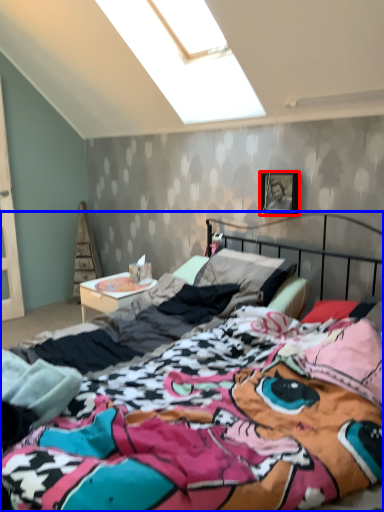
Question: Which of the following is the farthest to the observer, picture frame (highlighted by a red box) or bed (highlighted by a blue box)?

Choices:
 (A) picture frame
 (B) bed

Answer: (A)